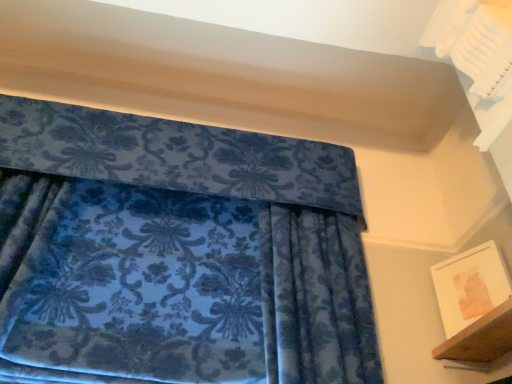
Question: In the image, is white matte picture frame at lower right positioned in front of or behind wooden shelf at lower right?

Choices:
 (A) front
 (B) behind

Answer: (B)

Question: Considering the relative positions of white matte picture frame at lower right and wooden shelf at lower right in the image provided, is white matte picture frame at lower right to the left or to the right of wooden shelf at lower right?

Choices:
 (A) left
 (B) right

Answer: (B)

Question: Do you think white matte picture frame at lower right is within wooden shelf at lower right, or outside of it?

Choices:
 (A) outside
 (B) inside

Answer: (A)

Question: From the image's perspective, relative to white matte picture frame at lower right, is wooden shelf at lower right above or below?

Choices:
 (A) above
 (B) below

Answer: (B)

Question: Considering the positions of wooden shelf at lower right and white matte picture frame at lower right in the image, is wooden shelf at lower right bigger or smaller than white matte picture frame at lower right?

Choices:
 (A) big
 (B) small

Answer: (A)

Question: From a real-world perspective, is wooden shelf at lower right above or below white matte picture frame at lower right?

Choices:
 (A) below
 (B) above

Answer: (A)

Question: Based on their positions, is wooden shelf at lower right located to the left or right of white matte picture frame at lower right?

Choices:
 (A) right
 (B) left

Answer: (B)